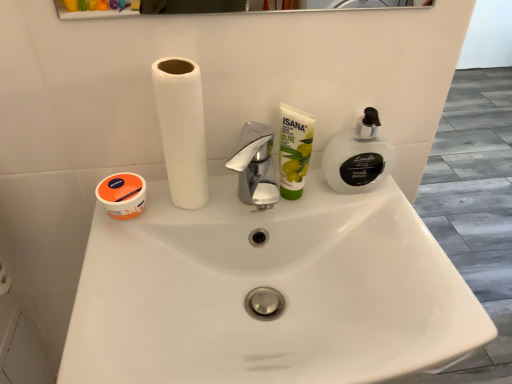
The height and width of the screenshot is (384, 512). Identify the location of free spot to the right of green matte olive oil cream at center. (383, 221).